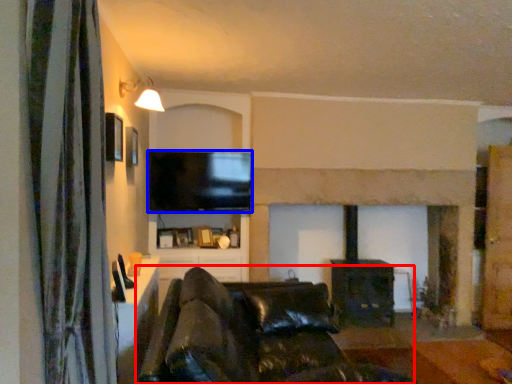
Question: Which object is further to the camera taking this photo, studio couch (highlighted by a red box) or television (highlighted by a blue box)?

Choices:
 (A) studio couch
 (B) television

Answer: (B)